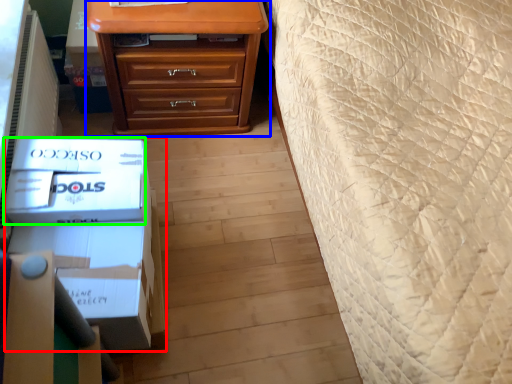
Question: Which object is positioned closest to box (highlighted by a red box)? Select from chest of drawers (highlighted by a blue box) and box (highlighted by a green box).

Choices:
 (A) chest of drawers
 (B) box

Answer: (B)